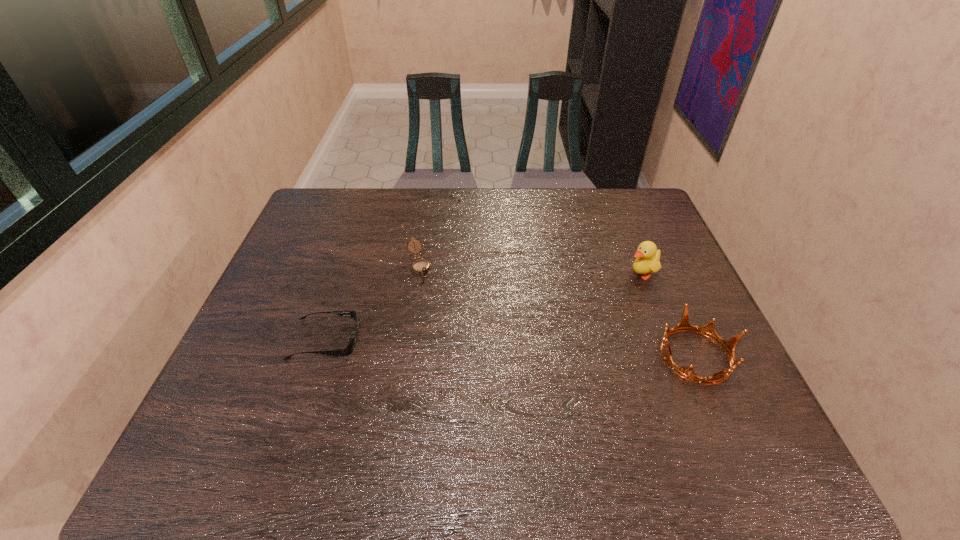
Where is `free space on the desktop that is between the shortest object and the crown and is positioned on the front-facing side of the tallest object`? free space on the desktop that is between the shortest object and the crown and is positioned on the front-facing side of the tallest object is located at coordinates (490, 347).

Identify the location of vacant spot on the desktop that is between the sunglasses and the third shortest object and is positioned on the face of the third object from right to left. The image size is (960, 540). tap(453, 345).